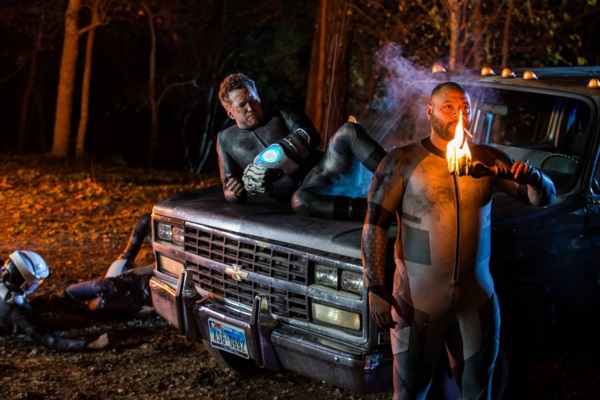
At what (x,y) coordinates should I click in order to perform the action: click on hood. Please return your answer as a coordinate pair (x, y). Looking at the image, I should click on (325, 225).